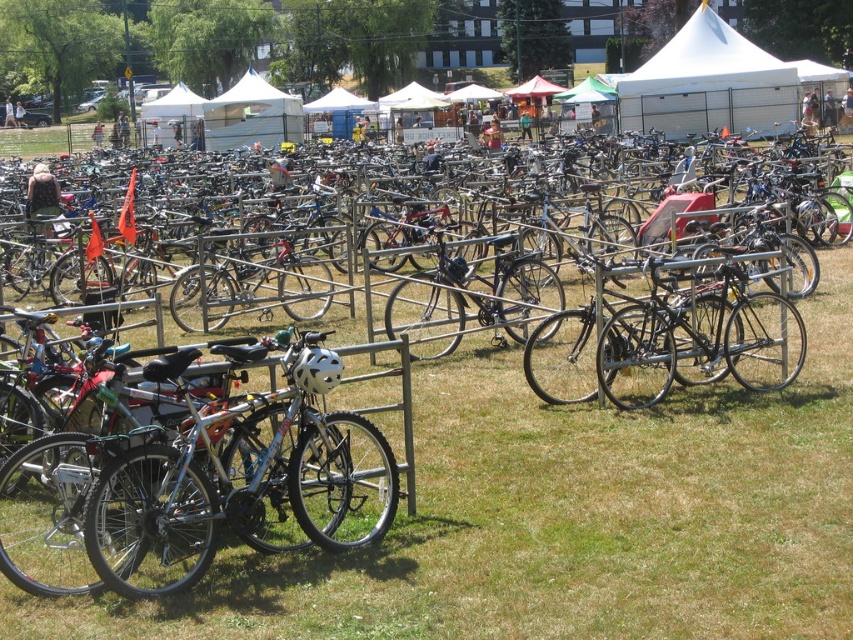
You are a photographer trying to capture both the shiny silver bicycle at center and the white fabric tent at center in a single frame. Based on their sizes, do you think they will both fit side by side horizontally in your camera viewfinder without overlapping?

The shiny silver bicycle at center might be wider than the white fabric tent at center, so there is a possibility they may not both fit side by side horizontally in the camera viewfinder without overlapping. Adjust your position or zoom level to ensure proper framing.

Based on the photo, you are at a park event and need to find your silver metallic bicycle at center. You see a white canvas tent at upper right in the distance. Which direction should you look to find your bicycle relative to the tent?

The silver metallic bicycle at center is located below the white canvas tent at upper right, so you should look downward from the tent to find your bicycle.